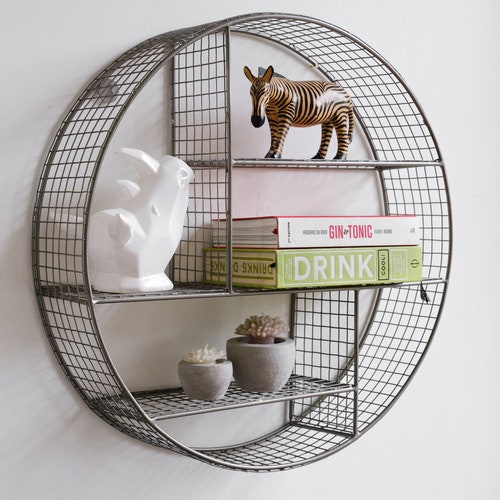
Locate an element on the screen. This screenshot has width=500, height=500. grey wall is located at coordinates tap(101, 479).